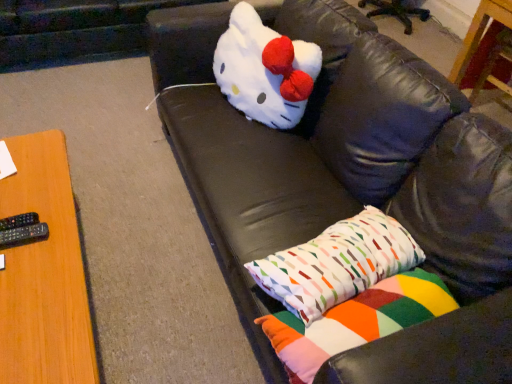
Question: From the image's perspective, would you say wooden table at left, placed as the first table when sorted from left to right, is positioned over black plastic remote at left, placed as the 1th remote when sorted from bottom to top?

Choices:
 (A) no
 (B) yes

Answer: (A)

Question: Can you confirm if wooden table at left, placed as the second table when sorted from top to bottom, is smaller than black plastic remote at left, placed as the 1th remote when sorted from bottom to top?

Choices:
 (A) yes
 (B) no

Answer: (B)

Question: From the image's perspective, would you say wooden table at left, marked as the 1th table in a front-to-back arrangement, is shown under black plastic remote at left, placed as the 1th remote when sorted from bottom to top?

Choices:
 (A) no
 (B) yes

Answer: (B)

Question: Is wooden table at left, the first table in the bottom-to-top sequence, positioned behind black plastic remote at left, placed as the 1th remote when sorted from bottom to top?

Choices:
 (A) no
 (B) yes

Answer: (A)

Question: From a real-world perspective, does wooden table at left, marked as the 1th table in a front-to-back arrangement, sit lower than black plastic remote at left, placed as the 1th remote when sorted from bottom to top?

Choices:
 (A) yes
 (B) no

Answer: (A)

Question: Looking at their shapes, would you say wooden table at upper right, which appears as the first table when viewed from the back, is wider or thinner than white plush toy at center?

Choices:
 (A) thin
 (B) wide

Answer: (A)

Question: In the image, is wooden table at upper right, which is the first table in top-to-bottom order, on the left side or the right side of white plush toy at center?

Choices:
 (A) right
 (B) left

Answer: (A)

Question: In terms of height, does wooden table at upper right, which is the first table in top-to-bottom order, look taller or shorter compared to white plush toy at center?

Choices:
 (A) short
 (B) tall

Answer: (B)

Question: Considering the positions of point (483, 18) and point (262, 74), is point (483, 18) closer or farther from the camera than point (262, 74)?

Choices:
 (A) farther
 (B) closer

Answer: (A)

Question: In terms of height, does wooden table at left, marked as the 1th table in a front-to-back arrangement, look taller or shorter compared to black leather couch at upper center?

Choices:
 (A) short
 (B) tall

Answer: (A)

Question: Is point (46, 182) positioned closer to the camera than point (388, 91)?

Choices:
 (A) farther
 (B) closer

Answer: (A)

Question: From the image's perspective, relative to black leather couch at upper center, is wooden table at left, the first table in the bottom-to-top sequence, above or below?

Choices:
 (A) above
 (B) below

Answer: (B)

Question: Considering their positions, is wooden table at left, marked as the 2th table in a back-to-front arrangement, located in front of or behind black leather couch at upper center?

Choices:
 (A) behind
 (B) front

Answer: (A)

Question: Is point (260, 266) closer or farther from the camera than point (289, 354)?

Choices:
 (A) closer
 (B) farther

Answer: (B)

Question: Considering the positions of geometric-patterned fabric pillow at lower right, placed as the 2th pillow when sorted from bottom to top, and multicolored fabric pillow at lower right, the second pillow when ordered from top to bottom, in the image, is geometric-patterned fabric pillow at lower right, placed as the 2th pillow when sorted from bottom to top, taller or shorter than multicolored fabric pillow at lower right, the second pillow when ordered from top to bottom,?

Choices:
 (A) short
 (B) tall

Answer: (A)